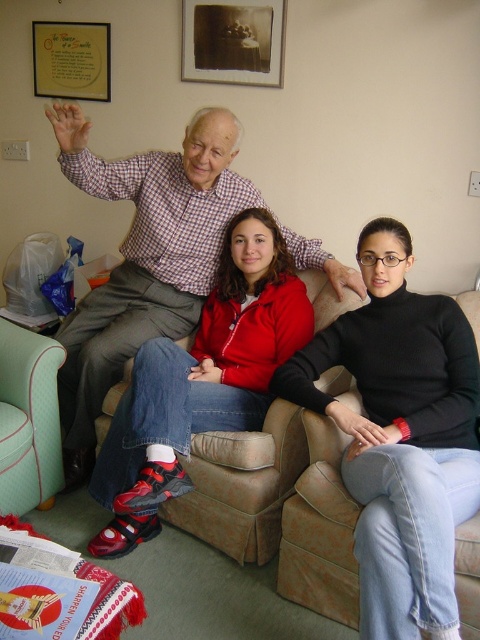
Question: Which of the following is the farthest from the observer?

Choices:
 (A) (113, 186)
 (B) (269, 84)

Answer: (B)

Question: Can you confirm if matte red jacket at center is wider than mint green fabric armchair at lower left?

Choices:
 (A) no
 (B) yes

Answer: (B)

Question: Which point is farther to the camera?

Choices:
 (A) checkered fabric shirt at upper left
 (B) matte red jacket at center
 (C) matte black picture frame at upper center

Answer: (C)

Question: Among these points, which one is nearest to the camera?

Choices:
 (A) (204, 168)
 (B) (352, 476)
 (C) (25, 337)
 (D) (204, 20)

Answer: (B)

Question: Does black turtleneck sweater at center appear over mint green fabric armchair at lower left?

Choices:
 (A) yes
 (B) no

Answer: (A)

Question: Observing the image, what is the correct spatial positioning of black turtleneck sweater at center in reference to matte black picture frame at upper center?

Choices:
 (A) left
 (B) right

Answer: (B)